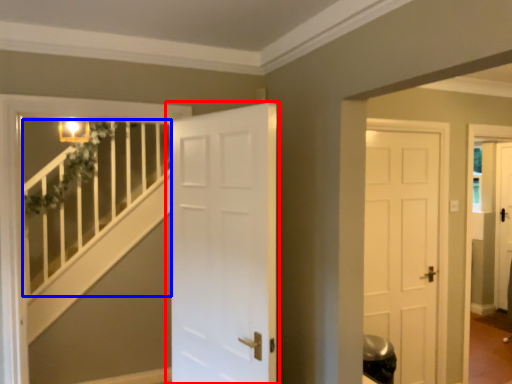
Question: Which point is further to the camera, door (highlighted by a red box) or balustrade (highlighted by a blue box)?

Choices:
 (A) door
 (B) balustrade

Answer: (B)